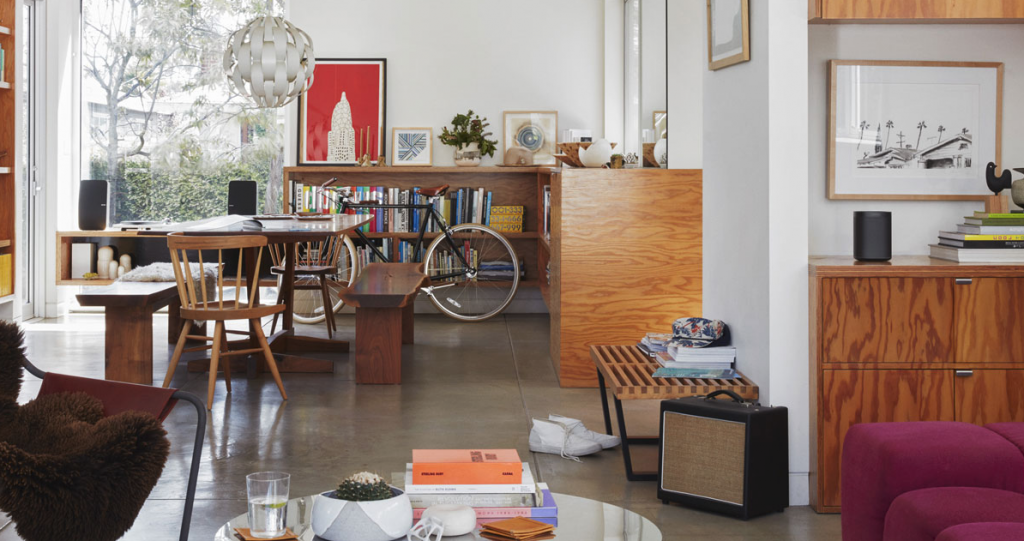
You are a GUI agent. You are given a task and a screenshot of the screen. Output one action in this format:
    pyautogui.click(x=<x>, y=<y>)
    Task: Click on the glass
    This screenshot has height=541, width=1024.
    Given the screenshot: What is the action you would take?
    pyautogui.click(x=270, y=488)